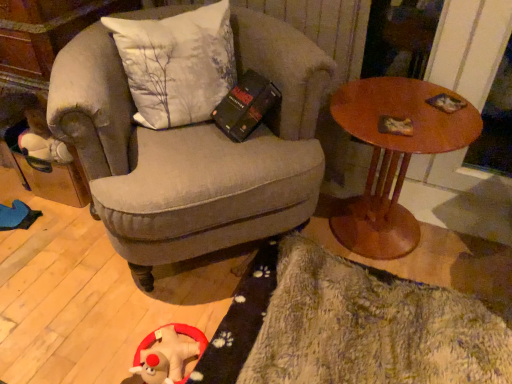
Question: Considering the positions of textured gray armchair at center and wooden round table at right in the image, is textured gray armchair at center taller or shorter than wooden round table at right?

Choices:
 (A) short
 (B) tall

Answer: (B)

Question: Considering the relative positions of textured gray armchair at center and wooden round table at right in the image provided, is textured gray armchair at center to the left or to the right of wooden round table at right?

Choices:
 (A) left
 (B) right

Answer: (A)

Question: Considering the real-world distances, which object is farthest from the wooden round table at right?

Choices:
 (A) textured gray armchair at center
 (B) white fabric pillow at upper left
 (C) fluffy beige rug at lower right
 (D) fuzzy plush toy at lower left

Answer: (D)

Question: Which object is positioned farthest from the white fabric pillow at upper left?

Choices:
 (A) fuzzy plush toy at lower left
 (B) textured gray armchair at center
 (C) fluffy beige rug at lower right
 (D) wooden round table at right

Answer: (A)